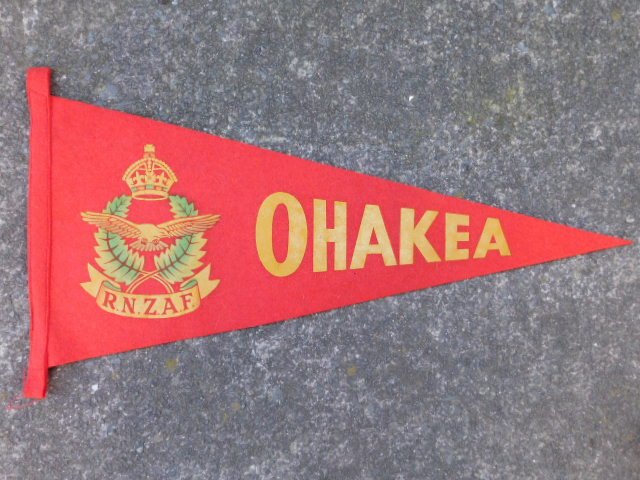
Identify the location of wall. This screenshot has height=480, width=640. (441, 139).